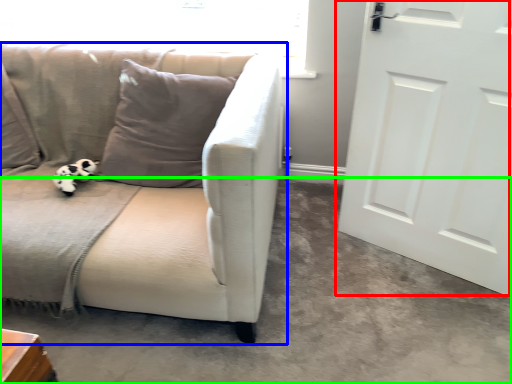
Question: Which is farther away from door (highlighted by a red box)? studio couch (highlighted by a blue box) or concrete (highlighted by a green box)?

Choices:
 (A) studio couch
 (B) concrete

Answer: (A)